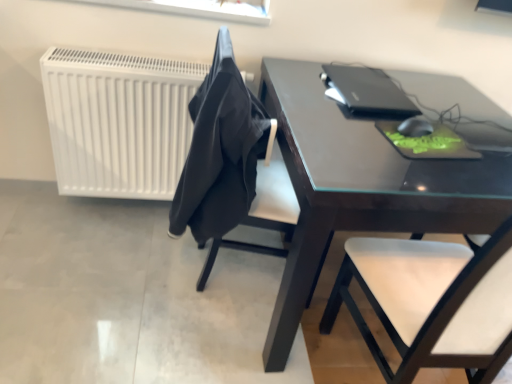
At what (x,y) coordinates should I click in order to perform the action: click on black matte mouse at upper right. Please return your answer as a coordinate pair (x, y). Looking at the image, I should click on (415, 127).

Measure the distance between black matte laptop at upper right and camera.

The distance of black matte laptop at upper right from camera is 1.39 meters.

The image size is (512, 384). Describe the element at coordinates (220, 151) in the screenshot. I see `black fabric at center` at that location.

Identify the location of dark brown glossy table at center. The width and height of the screenshot is (512, 384). (361, 187).

Describe the element at coordinates (274, 195) in the screenshot. I see `black fabric chair at center` at that location.

What is the approximate width of black fabric chair at center?

It is 19.22 inches.

I want to click on black matte mouse at upper right, so click(x=415, y=127).

Is the surface of dark brown glossy table at center in direct contact with black matte laptop at upper right?

No, dark brown glossy table at center is not beside black matte laptop at upper right.

From a real-world perspective, between dark brown glossy table at center and black matte laptop at upper right, who is vertically higher?

black matte laptop at upper right.

Between dark brown glossy table at center and black matte laptop at upper right, which one has smaller size?

With smaller size is black matte laptop at upper right.

From a real-world perspective, does white matte radiator at left sit lower than black matte mouse at upper right?

Indeed, from a real-world perspective, white matte radiator at left is positioned beneath black matte mouse at upper right.

Which is more to the right, white matte radiator at left or black matte mouse at upper right?

black matte mouse at upper right is more to the right.

Is white matte radiator at left not close to black matte mouse at upper right?

Yes, white matte radiator at left is far from black matte mouse at upper right.

Between black matte mouse at upper right and black matte laptop at upper right, which one appears on the left side from the viewer's perspective?

black matte laptop at upper right is more to the left.

Is point (414, 117) more distant than point (399, 113)?

That is False.

In terms of size, does black matte mouse at upper right appear bigger or smaller than black matte laptop at upper right?

In the image, black matte mouse at upper right appears to be smaller than black matte laptop at upper right.

Is black matte laptop at upper right taller than dark brown glossy table at center?

No.

You are a GUI agent. You are given a task and a screenshot of the screen. Output one action in this format:
    pyautogui.click(x=<x>, y=<y>)
    Task: Click on the laptop that appears behind the dark brown glossy table at center
    This screenshot has height=384, width=512.
    Given the screenshot: What is the action you would take?
    pyautogui.click(x=367, y=92)

Are black matte laptop at upper right and dark brown glossy table at center beside each other?

No, black matte laptop at upper right is not next to dark brown glossy table at center.

Is point (388, 91) closer or farther from the camera than point (484, 102)?

Point (388, 91).

Which object is further away from the camera, dark brown glossy table at center or white matte radiator at left?

Positioned behind is white matte radiator at left.

Considering the relative sizes of dark brown glossy table at center and white matte radiator at left in the image provided, is dark brown glossy table at center wider than white matte radiator at left?

Indeed, dark brown glossy table at center has a greater width compared to white matte radiator at left.

Is white matte radiator at left a part of dark brown glossy table at center?

No, white matte radiator at left is not a part of dark brown glossy table at center.

Considering the sizes of dark brown glossy table at center and white matte radiator at left in the image, is dark brown glossy table at center bigger or smaller than white matte radiator at left?

Clearly, dark brown glossy table at center is larger in size than white matte radiator at left.

Image resolution: width=512 pixels, height=384 pixels. I want to click on chair above the dark brown glossy table at center (from a real-world perspective), so click(x=274, y=195).

How different are the orientations of dark brown glossy table at center and black fabric chair at center in degrees?

They differ by 88.3 degrees in their facing directions.

Measure the distance from dark brown glossy table at center to black fabric chair at center.

dark brown glossy table at center and black fabric chair at center are 13.98 inches apart.

Considering the positions of objects dark brown glossy table at center and black fabric chair at center in the image provided, who is behind, dark brown glossy table at center or black fabric chair at center?

Positioned behind is black fabric chair at center.

In terms of width, does black fabric chair at center look wider or thinner when compared to dark brown glossy table at center?

black fabric chair at center is thinner than dark brown glossy table at center.

Considering the sizes of objects black fabric chair at center and dark brown glossy table at center in the image provided, who is bigger, black fabric chair at center or dark brown glossy table at center?

dark brown glossy table at center is bigger.

From the image's perspective, is black fabric chair at center beneath dark brown glossy table at center?

Incorrect, from the image's perspective, black fabric chair at center is higher than dark brown glossy table at center.

Considering the relative positions of black fabric chair at center and dark brown glossy table at center in the image provided, is black fabric chair at center to the left of dark brown glossy table at center from the viewer's perspective?

Yes, black fabric chair at center is to the left of dark brown glossy table at center.

Where is `table that is below the black matte laptop at upper right (from the image's perspective)`? The width and height of the screenshot is (512, 384). table that is below the black matte laptop at upper right (from the image's perspective) is located at coordinates (361, 187).

This screenshot has height=384, width=512. Find the location of `mouse above the white matte radiator at left (from a real-world perspective)`. mouse above the white matte radiator at left (from a real-world perspective) is located at coordinates (415, 127).

Estimate the real-world distances between objects in this image. Which object is further from black fabric chair at center, white matte radiator at left or black matte mouse at upper right?

black matte mouse at upper right is positioned further to the anchor black fabric chair at center.

Looking at the image, which one is located further to dark brown glossy table at center, black matte laptop at upper right or black fabric chair at center?

black fabric chair at center.

Estimate the real-world distances between objects in this image. Which object is closer to black matte mouse at upper right, black fabric at center or white matte radiator at left?

black fabric at center lies closer to black matte mouse at upper right than the other object.

From the picture: Considering their positions, is black matte laptop at upper right positioned closer to black matte mouse at upper right than dark brown glossy table at center?

Among the two, black matte laptop at upper right is located nearer to black matte mouse at upper right.

Which object lies further to the anchor point black matte laptop at upper right, black matte mouse at upper right or black fabric at center?

black fabric at center is positioned further to the anchor black matte laptop at upper right.

Estimate the real-world distances between objects in this image. Which object is further from black matte mouse at upper right, white matte radiator at left or dark brown glossy table at center?

white matte radiator at left.

Based on their spatial positions, is white matte radiator at left or black fabric chair at center further from black fabric at center?

Among the two, white matte radiator at left is located further to black fabric at center.

Looking at the image, which one is located further to white matte radiator at left, black matte mouse at upper right or black matte laptop at upper right?

black matte mouse at upper right.

The height and width of the screenshot is (384, 512). I want to click on cloth between white matte radiator at left and black matte mouse at upper right, so click(220, 151).

At what (x,y) coordinates should I click in order to perform the action: click on cloth situated between white matte radiator at left and dark brown glossy table at center from left to right. Please return your answer as a coordinate pair (x, y). The width and height of the screenshot is (512, 384). Looking at the image, I should click on (220, 151).

This screenshot has width=512, height=384. Identify the location of table situated between black fabric at center and black matte mouse at upper right from left to right. (361, 187).

Where is `chair between white matte radiator at left and black matte laptop at upper right in the horizontal direction`? This screenshot has width=512, height=384. chair between white matte radiator at left and black matte laptop at upper right in the horizontal direction is located at coordinates (274, 195).